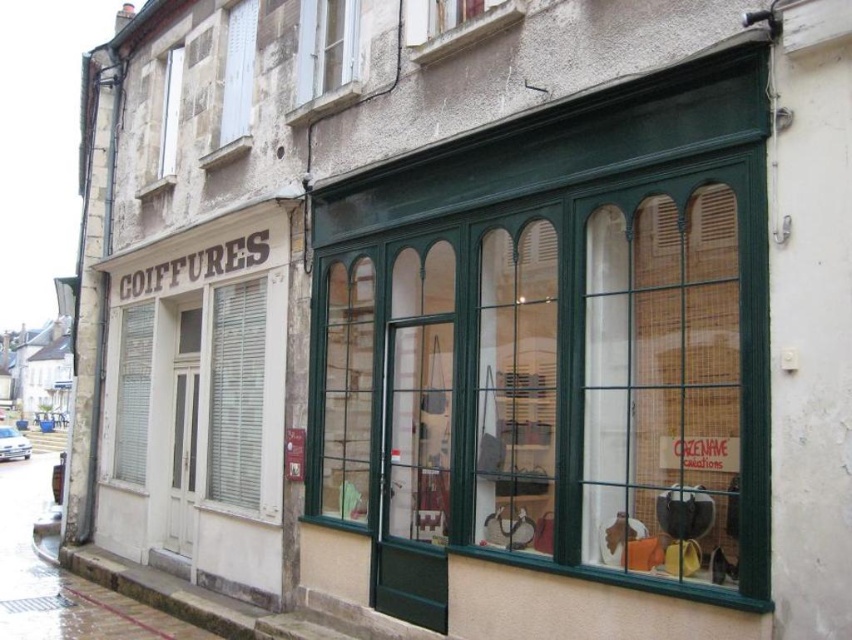
Question: Is green glass window at center to the right of white plastic shutters at center from the viewer's perspective?

Choices:
 (A) yes
 (B) no

Answer: (A)

Question: Does white plastic shutters at center have a larger size compared to white wooden window at upper center?

Choices:
 (A) yes
 (B) no

Answer: (A)

Question: Which of the following is the closest to the observer?

Choices:
 (A) (227, 32)
 (B) (245, 353)
 (C) (168, 125)
 (D) (387, 490)

Answer: (D)

Question: Estimate the real-world distances between objects in this image. Which object is farther from the white wooden shutter at upper left?

Choices:
 (A) white wood shutter at left
 (B) white plastic shutters at center

Answer: (A)

Question: Can you confirm if white wood shutter at left is positioned to the left of white wooden shutter at upper left?

Choices:
 (A) yes
 (B) no

Answer: (A)

Question: Estimate the real-world distances between objects in this image. Which object is farther from the white plastic shutters at center?

Choices:
 (A) white wood shutter at left
 (B) white wooden window at upper center

Answer: (B)